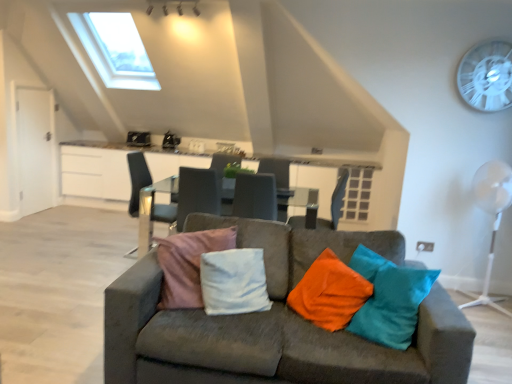
Question: Can you confirm if velvet grey couch at center is positioned to the right of white plastic mechanical fan at right?

Choices:
 (A) no
 (B) yes

Answer: (A)

Question: From the image's perspective, is velvet grey couch at center beneath white plastic mechanical fan at right?

Choices:
 (A) yes
 (B) no

Answer: (A)

Question: Can you confirm if velvet grey couch at center is wider than white plastic mechanical fan at right?

Choices:
 (A) yes
 (B) no

Answer: (A)

Question: From a real-world perspective, does velvet grey couch at center sit lower than white plastic mechanical fan at right?

Choices:
 (A) no
 (B) yes

Answer: (B)

Question: Can you confirm if velvet grey couch at center is taller than white plastic mechanical fan at right?

Choices:
 (A) no
 (B) yes

Answer: (A)

Question: Which is correct: velvet grey couch at center is inside matte gray chair at center, which is the second chair from left to right, or outside of it?

Choices:
 (A) outside
 (B) inside

Answer: (A)

Question: In the image, is velvet grey couch at center positioned in front of or behind matte gray chair at center, which appears as the first chair when viewed from the right?

Choices:
 (A) behind
 (B) front

Answer: (B)

Question: Considering the relative positions of velvet grey couch at center and matte gray chair at center, which is the second chair from left to right, in the image provided, is velvet grey couch at center to the left or to the right of matte gray chair at center, which is the second chair from left to right,?

Choices:
 (A) left
 (B) right

Answer: (A)

Question: From a real-world perspective, is velvet grey couch at center physically located above or below matte gray chair at center, which appears as the first chair when viewed from the right?

Choices:
 (A) above
 (B) below

Answer: (B)

Question: In terms of size, does transparent plastic fan at upper right appear bigger or smaller than matte gray chair at center, which appears as the first chair when viewed from the right?

Choices:
 (A) big
 (B) small

Answer: (B)

Question: From the image's perspective, is transparent plastic fan at upper right positioned above or below matte gray chair at center, which is the second chair from left to right?

Choices:
 (A) below
 (B) above

Answer: (B)

Question: Is transparent plastic fan at upper right in front of or behind matte gray chair at center, which appears as the first chair when viewed from the right, in the image?

Choices:
 (A) front
 (B) behind

Answer: (A)

Question: Which is correct: transparent plastic fan at upper right is inside matte gray chair at center, which appears as the first chair when viewed from the right, or outside of it?

Choices:
 (A) outside
 (B) inside

Answer: (A)

Question: Is metallic silver chair at center, the first chair when ordered from left to right, wider or thinner than transparent plastic fan at upper right?

Choices:
 (A) wide
 (B) thin

Answer: (A)

Question: Would you say metallic silver chair at center, the second chair from the right, is to the left or to the right of transparent plastic fan at upper right in the picture?

Choices:
 (A) right
 (B) left

Answer: (B)